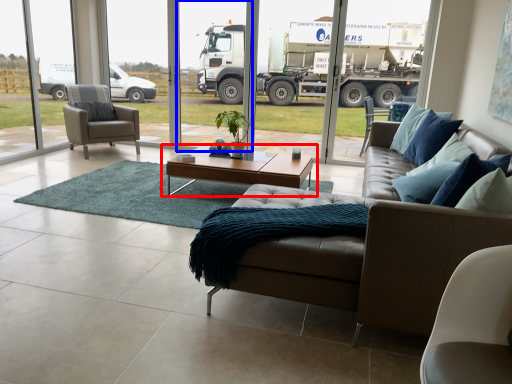
Question: Which point is further to the camera, coffee table (highlighted by a red box) or screen door (highlighted by a blue box)?

Choices:
 (A) coffee table
 (B) screen door

Answer: (B)